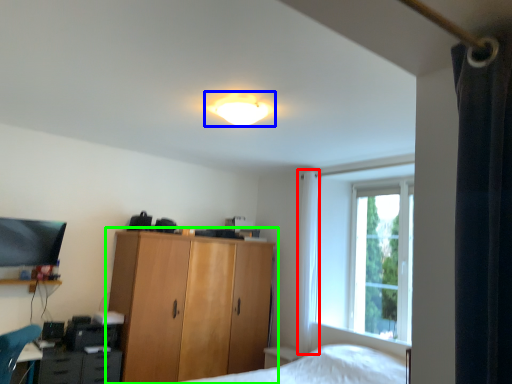
Question: Considering the real-world distances, which object is farthest from curtain (highlighted by a red box)? lamp (highlighted by a blue box) or cupboard (highlighted by a green box)?

Choices:
 (A) lamp
 (B) cupboard

Answer: (A)